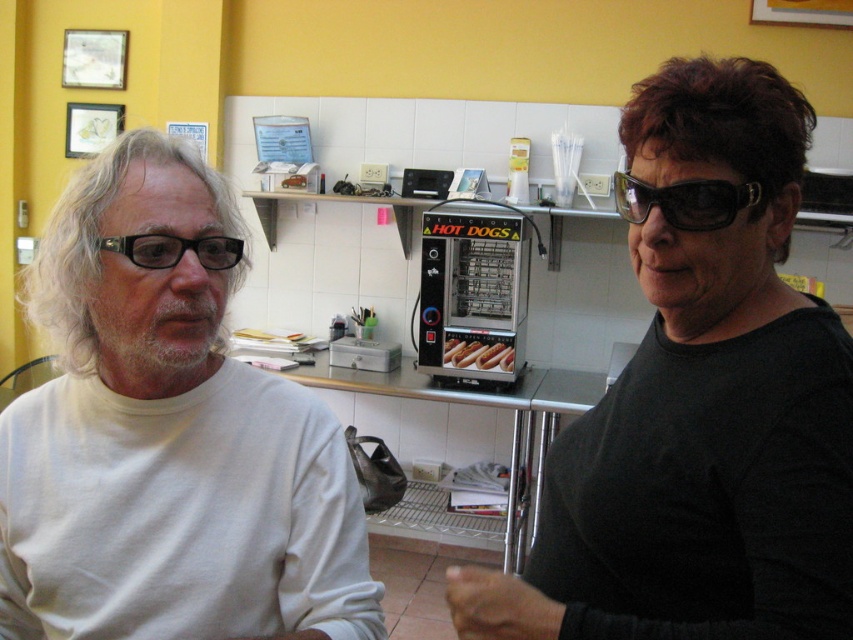
Question: Among these points, which one is nearest to the camera?

Choices:
 (A) (485, 342)
 (B) (202, 252)
 (C) (706, 209)

Answer: (C)

Question: Based on their relative distances, which object is farther from the sunglasses at right?

Choices:
 (A) black plastic glasses at left
 (B) white matte shirt at left

Answer: (B)

Question: Is sunglasses at right positioned in front of slightly toasted hot dog bun at center?

Choices:
 (A) no
 (B) yes

Answer: (B)

Question: Is white matte shirt at left wider than sunglasses at right?

Choices:
 (A) no
 (B) yes

Answer: (B)

Question: Considering the real-world distances, which object is closest to the sunglasses at right?

Choices:
 (A) slightly toasted hot dog bun at center
 (B) black plastic glasses at left
 (C) white matte shirt at left

Answer: (B)

Question: Is white matte shirt at left positioned at the back of sunglasses at right?

Choices:
 (A) yes
 (B) no

Answer: (A)